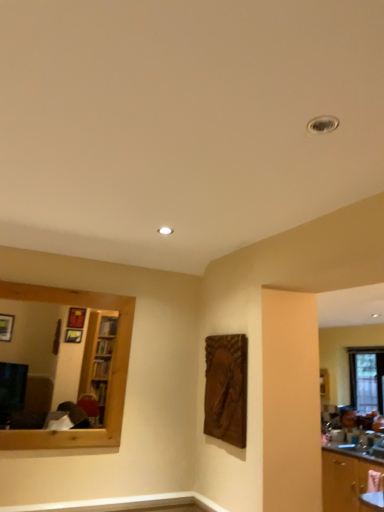
Question: Can you confirm if wooden cabinet at lower right is shorter than wooden mirror at left?

Choices:
 (A) yes
 (B) no

Answer: (B)

Question: From the image's perspective, would you say wooden cabinet at lower right is shown under wooden mirror at left?

Choices:
 (A) yes
 (B) no

Answer: (A)

Question: Does wooden cabinet at lower right have a smaller size compared to wooden mirror at left?

Choices:
 (A) no
 (B) yes

Answer: (A)

Question: Does wooden cabinet at lower right lie behind wooden mirror at left?

Choices:
 (A) no
 (B) yes

Answer: (B)

Question: Does wooden cabinet at lower right have a larger size compared to wooden mirror at left?

Choices:
 (A) no
 (B) yes

Answer: (B)

Question: Is point (61, 330) positioned closer to the camera than point (370, 403)?

Choices:
 (A) closer
 (B) farther

Answer: (A)

Question: Considering their positions, is wooden mirror at left located in front of or behind clear glass window at right?

Choices:
 (A) front
 (B) behind

Answer: (A)

Question: From a real-world perspective, relative to clear glass window at right, is wooden mirror at left vertically above or below?

Choices:
 (A) above
 (B) below

Answer: (A)

Question: From the image's perspective, is wooden mirror at left located above or below clear glass window at right?

Choices:
 (A) below
 (B) above

Answer: (B)

Question: From the image's perspective, relative to wooden cabinet at lower right, is wooden mirror at left above or below?

Choices:
 (A) below
 (B) above

Answer: (B)

Question: Looking at their shapes, would you say wooden mirror at left is wider or thinner than wooden cabinet at lower right?

Choices:
 (A) wide
 (B) thin

Answer: (B)

Question: From their relative heights in the image, would you say wooden mirror at left is taller or shorter than wooden cabinet at lower right?

Choices:
 (A) tall
 (B) short

Answer: (B)

Question: Is wooden mirror at left to the left or to the right of wooden cabinet at lower right in the image?

Choices:
 (A) right
 (B) left

Answer: (B)

Question: Is point (360, 375) closer or farther from the camera than point (74, 355)?

Choices:
 (A) closer
 (B) farther

Answer: (B)

Question: Do you think clear glass window at right is within wooden mirror at left, or outside of it?

Choices:
 (A) inside
 (B) outside

Answer: (B)